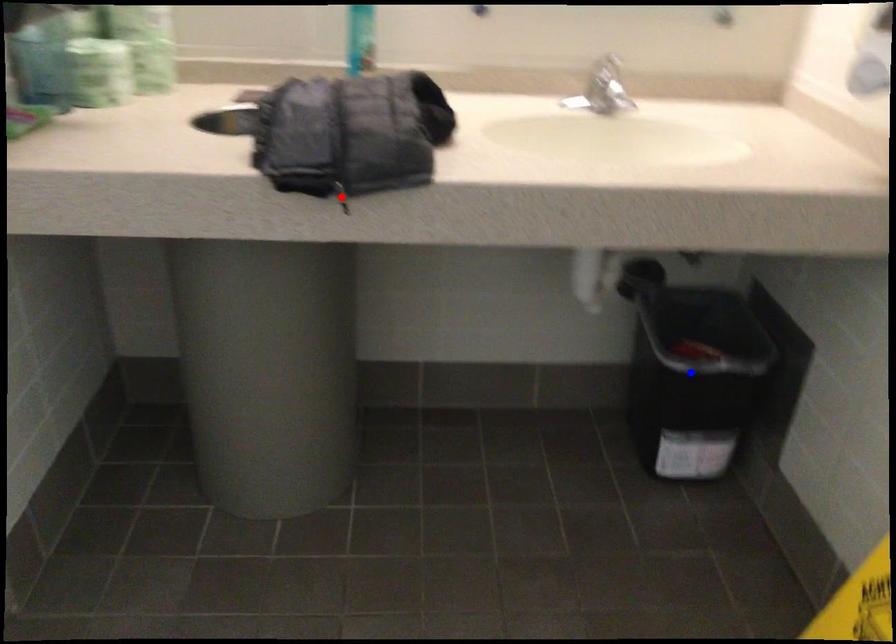
Question: Two points are marked on the image. Which point is closer to the camera?

Choices:
 (A) Blue point is closer.
 (B) Red point is closer.

Answer: (B)